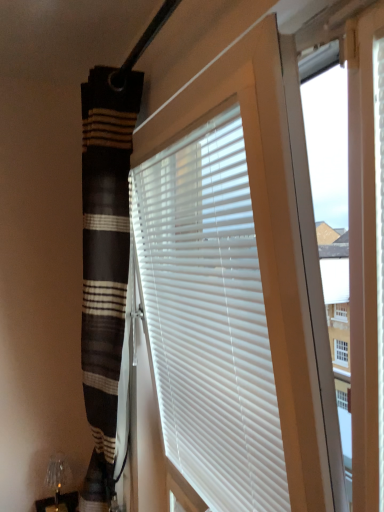
The image size is (384, 512). What do you see at coordinates (209, 318) in the screenshot?
I see `white matte blinds at center` at bounding box center [209, 318].

The image size is (384, 512). I want to click on white matte blinds at center, so click(209, 318).

In order to face metallic silver table lamp at lower left, should I rotate leftwards or rightwards?

Rotate your view left by about 17.745°.

What do you see at coordinates (57, 480) in the screenshot?
I see `metallic silver table lamp at lower left` at bounding box center [57, 480].

Consider the image. Measure the distance between metallic silver table lamp at lower left and camera.

The distance of metallic silver table lamp at lower left from camera is 1.88 meters.

What are the coordinates of `metallic silver table lamp at lower left` in the screenshot? It's located at (57, 480).

Locate an element on the screen. This screenshot has width=384, height=512. white matte blinds at center is located at coordinates (209, 318).

Looking at this image, is metallic silver table lamp at lower left at the left side of white matte blinds at center?

Correct, you'll find metallic silver table lamp at lower left to the left of white matte blinds at center.

Is the depth of metallic silver table lamp at lower left greater than that of white matte blinds at center?

Yes.

Between point (49, 485) and point (234, 316), which one is positioned in front?

Point (234, 316)

From the image's perspective, which one is positioned higher, metallic silver table lamp at lower left or white matte blinds at center?

white matte blinds at center, from the image's perspective.

From a real-world perspective, is metallic silver table lamp at lower left positioned above or below white matte blinds at center?

metallic silver table lamp at lower left is situated lower than white matte blinds at center in the real world.

Based on the photo, does metallic silver table lamp at lower left have a greater width compared to white matte blinds at center?

Indeed, metallic silver table lamp at lower left has a greater width compared to white matte blinds at center.

Can you confirm if metallic silver table lamp at lower left is shorter than white matte blinds at center?

Indeed, metallic silver table lamp at lower left has a lesser height compared to white matte blinds at center.

Can you confirm if metallic silver table lamp at lower left is smaller than white matte blinds at center?

Indeed, metallic silver table lamp at lower left has a smaller size compared to white matte blinds at center.

In the scene shown: Which is correct: metallic silver table lamp at lower left is inside white matte blinds at center, or outside of it?

metallic silver table lamp at lower left is located beyond the bounds of white matte blinds at center.

Is metallic silver table lamp at lower left in contact with white matte blinds at center?

metallic silver table lamp at lower left and white matte blinds at center are not in contact.

Is metallic silver table lamp at lower left aimed at white matte blinds at center?

No, metallic silver table lamp at lower left is not aimed at white matte blinds at center.

At what (x,y) coordinates should I click in order to perform the action: click on table lamp that appears behind the white matte blinds at center. Please return your answer as a coordinate pair (x, y). This screenshot has width=384, height=512. Looking at the image, I should click on (57, 480).

From the picture: Is white matte blinds at center to the left or to the right of metallic silver table lamp at lower left in the image?

white matte blinds at center is positioned on metallic silver table lamp at lower left's right side.

Is the depth of white matte blinds at center less than that of metallic silver table lamp at lower left?

That is True.

Does point (154, 333) come closer to viewer compared to point (57, 474)?

Yes, it is.

From the image's perspective, is white matte blinds at center located beneath metallic silver table lamp at lower left?

No.

From a real-world perspective, who is located lower, white matte blinds at center or metallic silver table lamp at lower left?

metallic silver table lamp at lower left.

Is white matte blinds at center wider or thinner than metallic silver table lamp at lower left?

Considering their sizes, white matte blinds at center looks slimmer than metallic silver table lamp at lower left.

Does white matte blinds at center have a greater height compared to metallic silver table lamp at lower left?

Indeed, white matte blinds at center has a greater height compared to metallic silver table lamp at lower left.

Does white matte blinds at center have a larger size compared to metallic silver table lamp at lower left?

Indeed, white matte blinds at center has a larger size compared to metallic silver table lamp at lower left.

Is white matte blinds at center spatially inside metallic silver table lamp at lower left, or outside of it?

white matte blinds at center exists outside the volume of metallic silver table lamp at lower left.

Is white matte blinds at center far from metallic silver table lamp at lower left?

white matte blinds at center is far away from metallic silver table lamp at lower left.

Looking at this image, is white matte blinds at center facing towards metallic silver table lamp at lower left?

No, white matte blinds at center is not facing towards metallic silver table lamp at lower left.

How different are the orientations of white matte blinds at center and metallic silver table lamp at lower left in degrees?

The angle between the facing direction of white matte blinds at center and the facing direction of metallic silver table lamp at lower left is 91.4 degrees.

This screenshot has width=384, height=512. I want to click on table lamp on the left of white matte blinds at center, so click(57, 480).

There is a metallic silver table lamp at lower left. Identify the location of window blind above it (from a real-world perspective). (209, 318).

This screenshot has width=384, height=512. In order to click on table lamp behind the white matte blinds at center in this screenshot , I will do `click(57, 480)`.